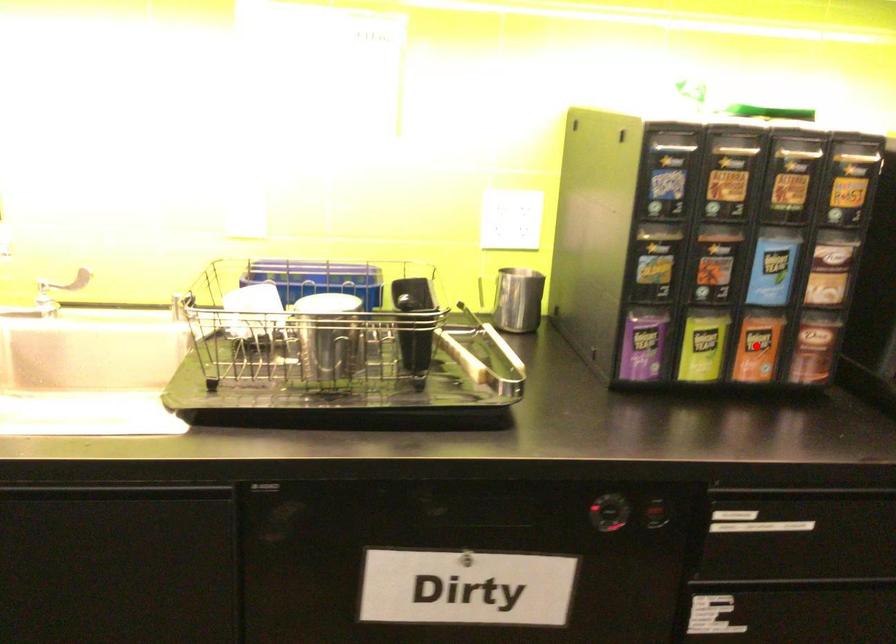
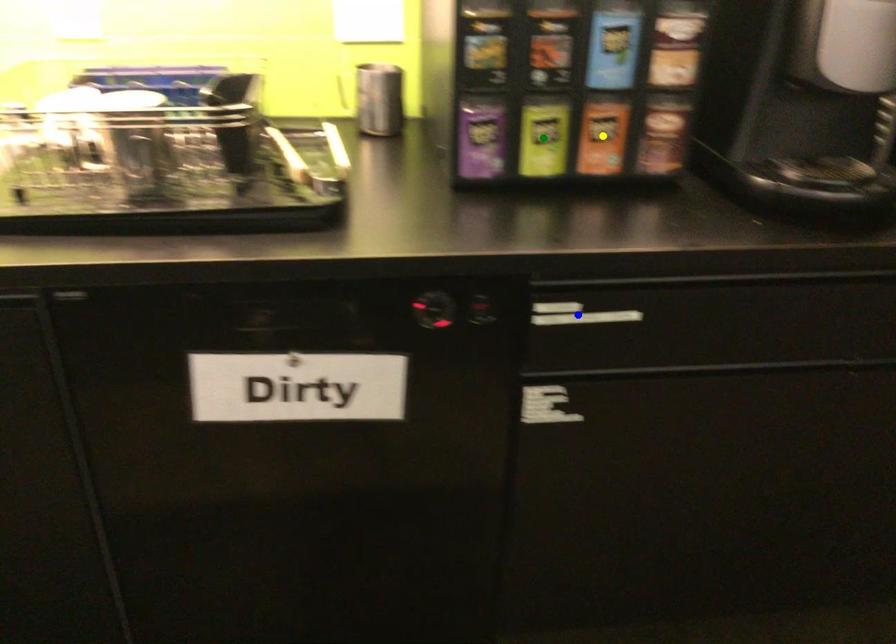
Question: I am providing you with two images of the same scene from different viewpoints. A red point is marked on the first image. You are given multiple points on the second image. Which mark in image 2 goes with the point in image 1?

Choices:
 (A) green point
 (B) blue point
 (C) yellow point

Answer: (C)